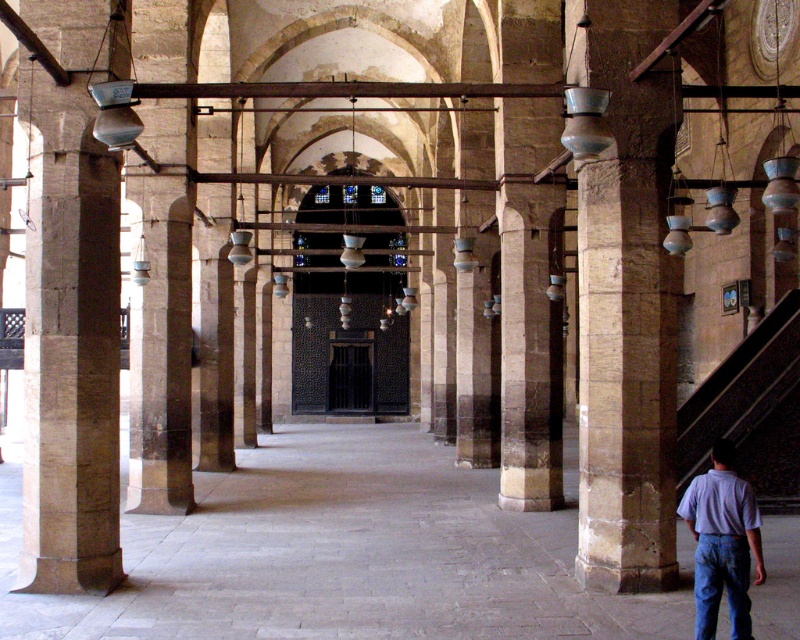
Question: Is dark brown stone stairs at lower right thinner than blue denim jeans at lower right?

Choices:
 (A) no
 (B) yes

Answer: (B)

Question: Which of these objects is positioned closest to the blue denim jeans at lower right?

Choices:
 (A) purple cotton shirt at lower right
 (B) dark brown stone stairs at lower right
 (C) smooth stone column at left
 (D) light blue shirt at lower right

Answer: (D)

Question: Based on their relative distances, which object is farther from the dark brown stone stairs at lower right?

Choices:
 (A) light blue shirt at lower right
 (B) purple cotton shirt at lower right

Answer: (A)

Question: Which of these objects is positioned closest to the blue denim jeans at lower right?

Choices:
 (A) light blue shirt at lower right
 (B) purple cotton shirt at lower right
 (C) smooth stone column at left
 (D) dark brown stone stairs at lower right

Answer: (A)

Question: In this image, where is smooth stone column at left located relative to blue denim jeans at lower right?

Choices:
 (A) left
 (B) right

Answer: (A)

Question: Can you confirm if dark brown stone stairs at lower right is positioned above blue denim jeans at lower right?

Choices:
 (A) no
 (B) yes

Answer: (B)